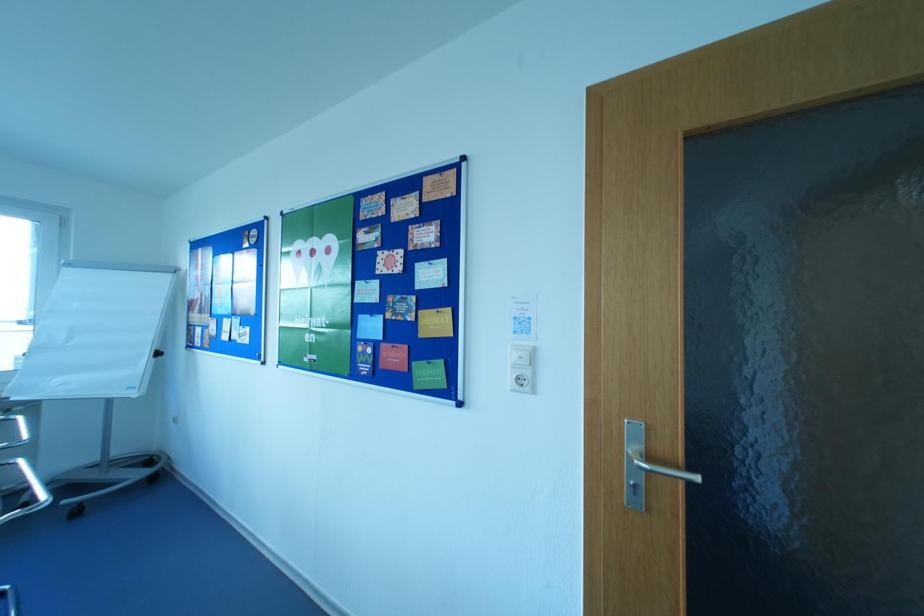
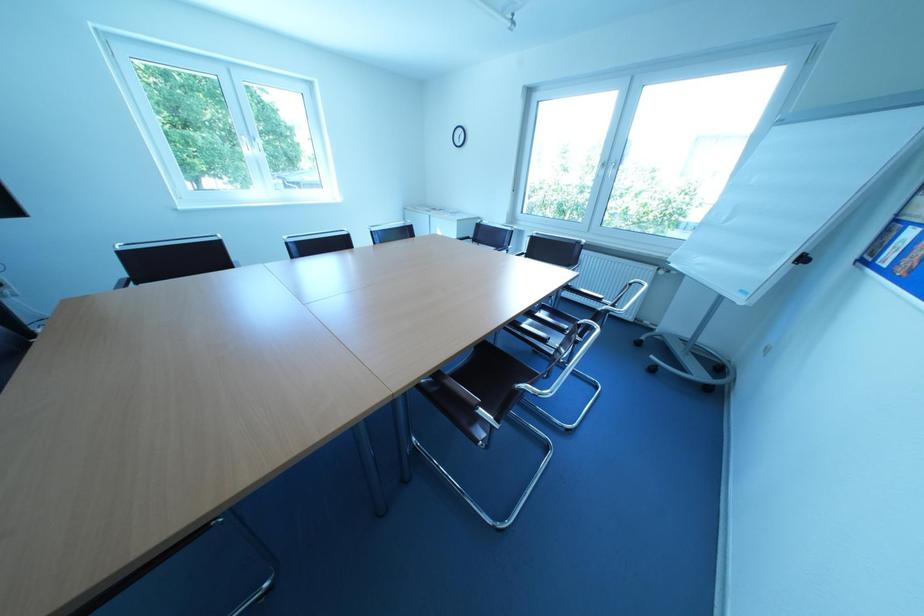
Based on the continuous images, in which direction is the camera rotating?

The rotation direction of the camera is left-down.